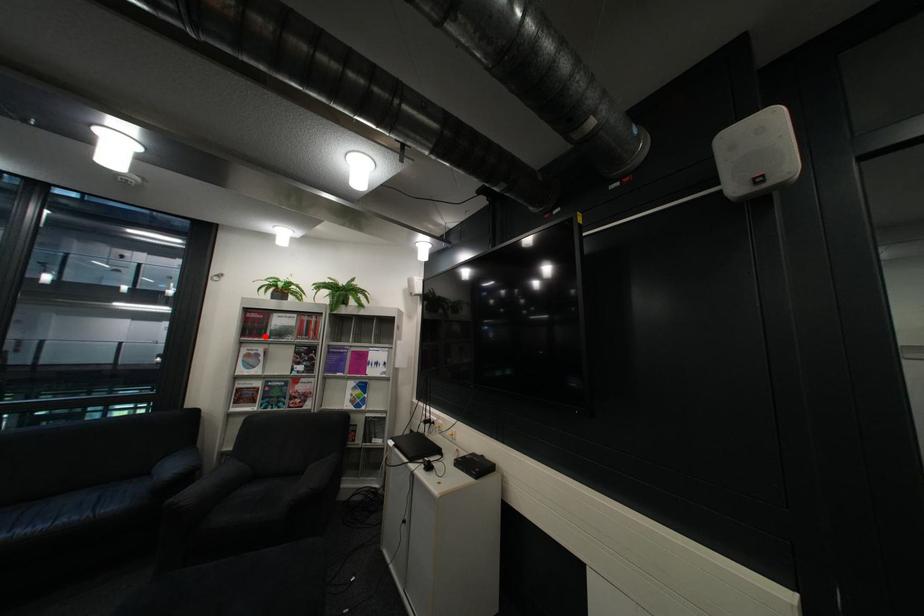
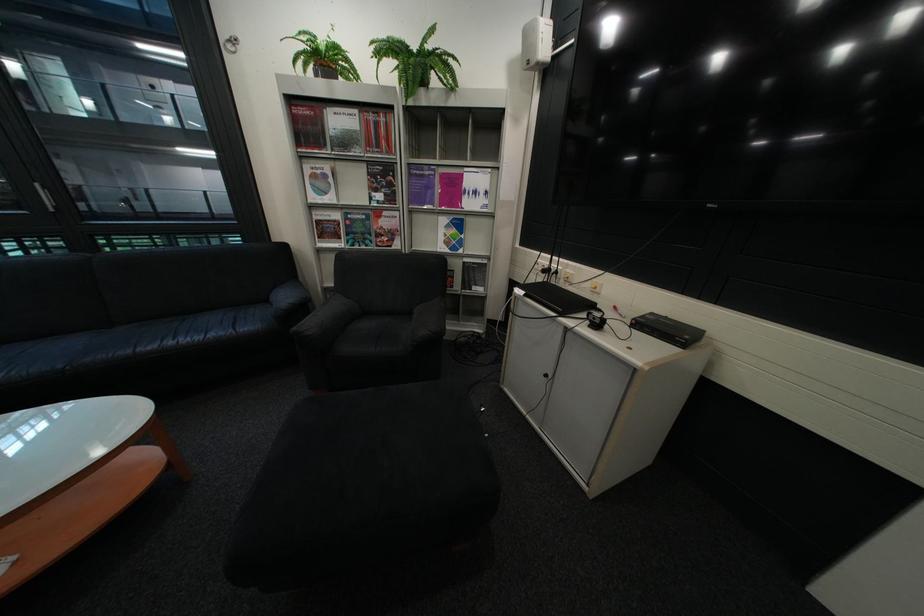
Question: A red point is marked in image1. In image2, is the corresponding 3D point closer to the camera or farther? Reply with the corresponding letter.

Choices:
 (A) The corresponding 3D point is closer.
 (B) The corresponding 3D point is farther.

Answer: (A)